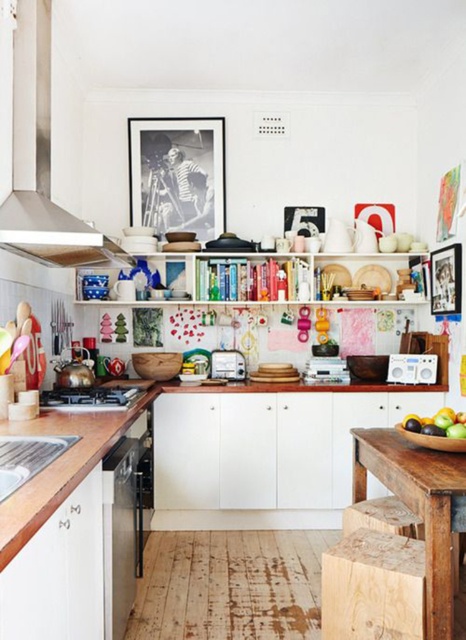
Who is positioned more to the right, wooden stool at lower center or matte silver radio at center?

Positioned to the right is matte silver radio at center.

Is wooden stool at lower center shorter than matte silver radio at center?

Yes.

What do you see at coordinates (382, 516) in the screenshot?
I see `wooden stool at lower center` at bounding box center [382, 516].

Where is `wooden stool at lower center`? Image resolution: width=466 pixels, height=640 pixels. wooden stool at lower center is located at coordinates (382, 516).

Is satin silver dishwasher at lower left bigger than wooden stool at lower center?

Indeed, satin silver dishwasher at lower left has a larger size compared to wooden stool at lower center.

This screenshot has width=466, height=640. I want to click on satin silver dishwasher at lower left, so point(121,532).

You are a GUI agent. You are given a task and a screenshot of the screen. Output one action in this format:
    pyautogui.click(x=<x>, y=<y>)
    Task: Click on the satin silver dishwasher at lower left
    
    Given the screenshot: What is the action you would take?
    pyautogui.click(x=121, y=532)

Based on the photo, who is higher up, rustic wood table at center or wooden picture frame at upper center?

wooden picture frame at upper center

Does rustic wood table at center have a lesser width compared to wooden picture frame at upper center?

In fact, rustic wood table at center might be wider than wooden picture frame at upper center.

This screenshot has width=466, height=640. Find the location of `rustic wood table at center`. rustic wood table at center is located at coordinates (418, 506).

Locate an element on the screen. This screenshot has width=466, height=640. rustic wood table at center is located at coordinates (418, 506).